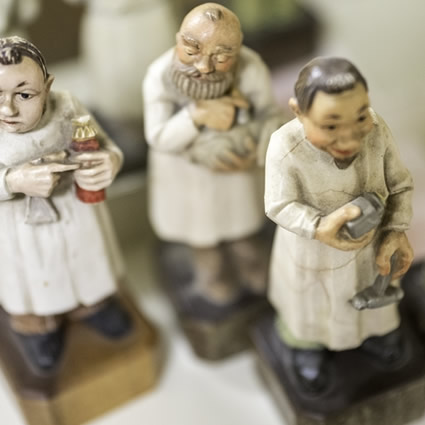
Find the location of a particular element. white surface is located at coordinates (197, 421).